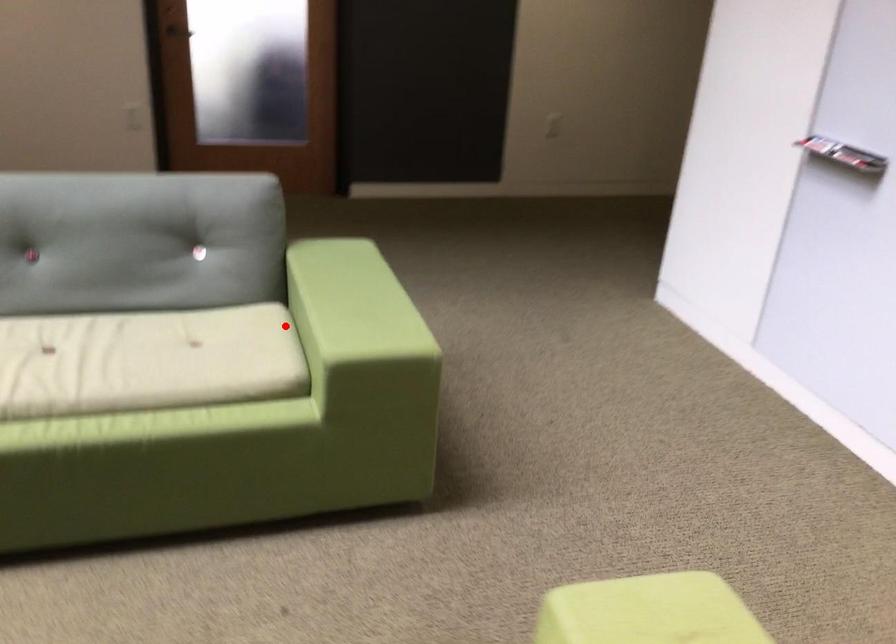
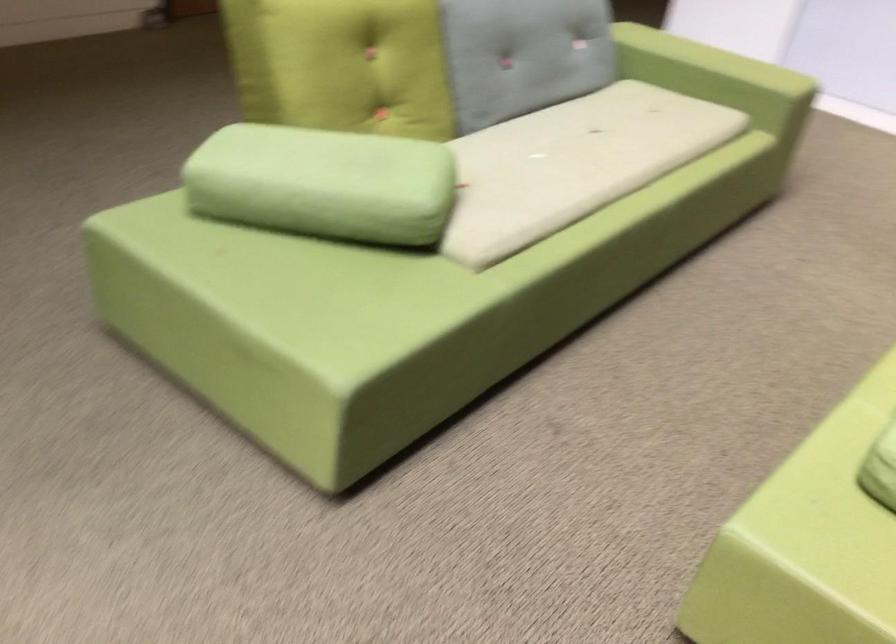
Question: I am providing you with two images of the same scene from different viewpoints. In image1, a red point is highlighted. Considering the same 3D point in image2, which of the following is correct?

Choices:
 (A) It is closer
 (B) It is farther

Answer: (B)